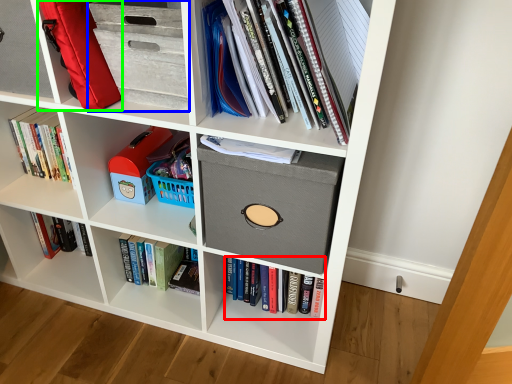
Question: Which is nearer to the book (highlighted by a red box)? cabinet (highlighted by a blue box) or luggage (highlighted by a green box).

Choices:
 (A) cabinet
 (B) luggage

Answer: (A)